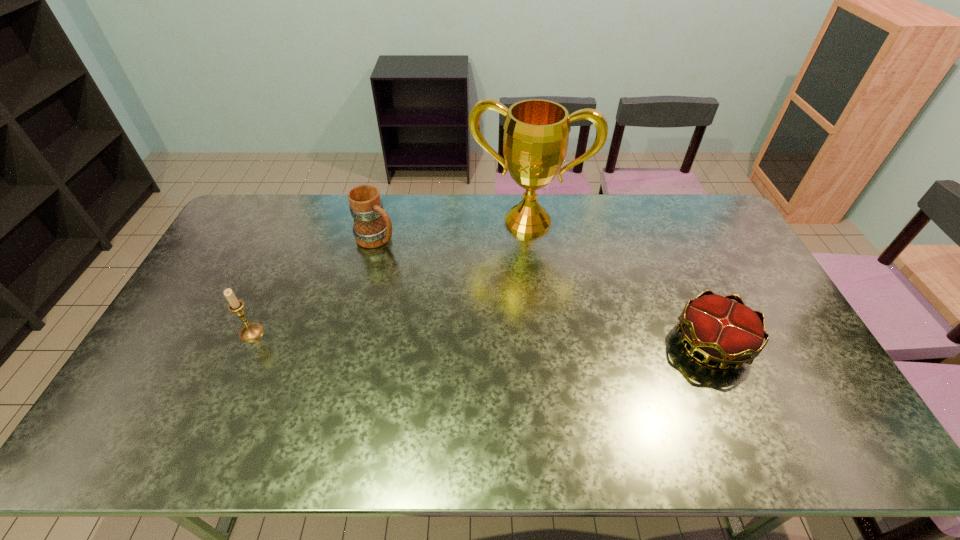
At what (x,y) coordinates should I click in order to perform the action: click on free spot on the desktop that is between the candle holder and the crown and is positioned on the side of the mug with the handle. Please return your answer as a coordinate pair (x, y). The height and width of the screenshot is (540, 960). Looking at the image, I should click on (541, 340).

In order to click on vacant space on the desktop that is between the leftmost object and the crown and is positioned on the front-facing side of the third object from left to right in this screenshot , I will do `click(500, 339)`.